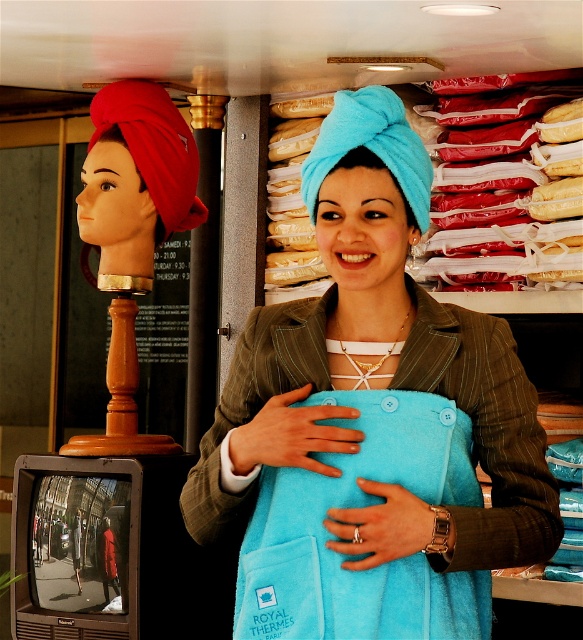
Question: Which point is farther to the camera?

Choices:
 (A) (405, 208)
 (B) (339, 400)
 (C) (107, 157)
 (D) (247, 612)

Answer: (C)

Question: Can you confirm if red fabric head at left is smaller than blue terry cloth towel at center?

Choices:
 (A) no
 (B) yes

Answer: (A)

Question: Which object is farther from the camera taking this photo?

Choices:
 (A) blue terry cloth towel at center
 (B) turquoise towel at center
 (C) turquoise fleece apron at center

Answer: (A)

Question: Does turquoise fleece apron at center appear on the left side of blue terry cloth towel at center?

Choices:
 (A) no
 (B) yes

Answer: (A)

Question: Which object is farther from the camera taking this photo?

Choices:
 (A) turquoise towel at center
 (B) blue terry cloth towel at center
 (C) turquoise fleece apron at center

Answer: (B)

Question: Does turquoise towel at center have a lesser width compared to turquoise fleece apron at center?

Choices:
 (A) no
 (B) yes

Answer: (A)